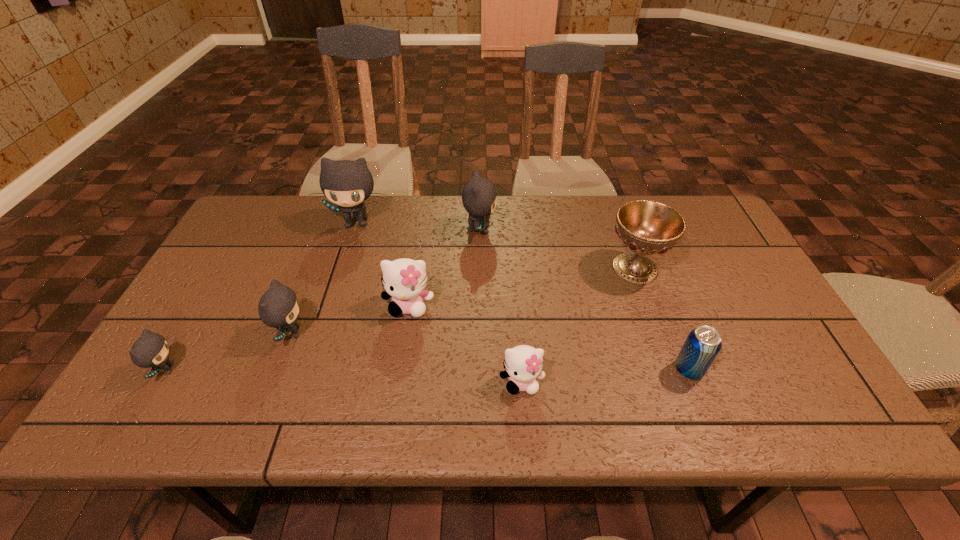
This screenshot has width=960, height=540. Find the location of `the tallest kitten`. the tallest kitten is located at coordinates (347, 184).

Find the location of `the biggest gray kitten`. the biggest gray kitten is located at coordinates (347, 184).

Find the location of a particular element. the second biggest gray kitten is located at coordinates (479, 195).

Where is `chalice`? chalice is located at coordinates (646, 227).

Identify the location of the fourth kitten from left to right. The width and height of the screenshot is (960, 540). (404, 280).

Find the location of a particular element. This screenshot has height=540, width=960. the bigger white kitten is located at coordinates (404, 280).

Where is `the third biggest gray kitten`? the third biggest gray kitten is located at coordinates (278, 307).

You are a GUI agent. You are given a task and a screenshot of the screen. Output one action in this format:
    pyautogui.click(x=<x>, y=<y>)
    Task: Click on the beer can
    The image size is (960, 540).
    Given the screenshot: What is the action you would take?
    pyautogui.click(x=703, y=344)

At what (x,y) coordinates should I click in order to perform the action: click on the smaller white kitten. Please return your answer as a coordinate pair (x, y). This screenshot has height=540, width=960. Looking at the image, I should click on (523, 363).

Identify the location of the right white kitten. The height and width of the screenshot is (540, 960). (523, 363).